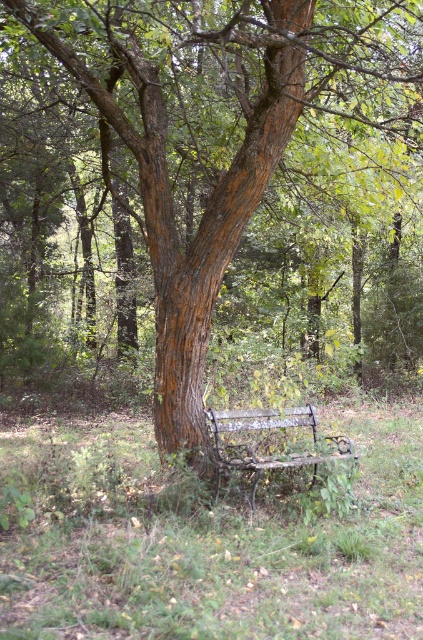
Question: Which of the following is the farthest from the observer?

Choices:
 (A) green grass at lower center
 (B) rusty metal bench at center

Answer: (B)

Question: Does green grass at lower center have a lesser width compared to rusty metal bench at center?

Choices:
 (A) no
 (B) yes

Answer: (B)

Question: Is green grass at lower center positioned at the back of rusty metal bench at center?

Choices:
 (A) yes
 (B) no

Answer: (B)

Question: Is green grass at lower center positioned at the back of rusty metal bench at center?

Choices:
 (A) no
 (B) yes

Answer: (A)